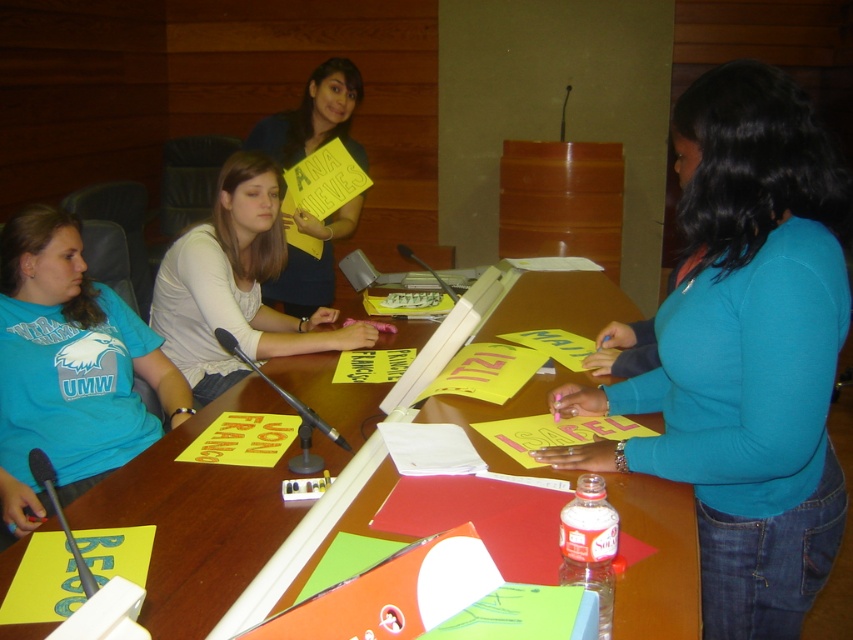
Question: Estimate the real-world distances between objects in this image. Which object is farther from the blue matte shirt at center?

Choices:
 (A) yellow paper sign at center
 (B) metallic silver microphone at center
 (C) blue cotton shirt at left

Answer: (A)

Question: Is blue matte shirt at center bigger than black plastic microphone at center?

Choices:
 (A) no
 (B) yes

Answer: (B)

Question: Which object is farther from the camera taking this photo?

Choices:
 (A) wooden table at center
 (B) black plastic microphone at lower left

Answer: (B)

Question: Which object appears farthest from the camera in this image?

Choices:
 (A) blue matte shirt at center
 (B) yellow paper sign at center

Answer: (B)

Question: Is blue matte shirt at center below white matte shirt at center?

Choices:
 (A) no
 (B) yes

Answer: (B)

Question: Does wooden table at center have a larger size compared to black plastic microphone at center?

Choices:
 (A) yes
 (B) no

Answer: (A)